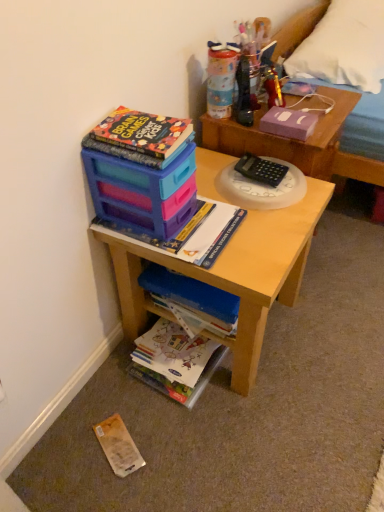
Identify the location of vacant area located to the right-hand side of yellow paper at lower left, arranged as the first paperback book when ordered from the bottom. (165, 443).